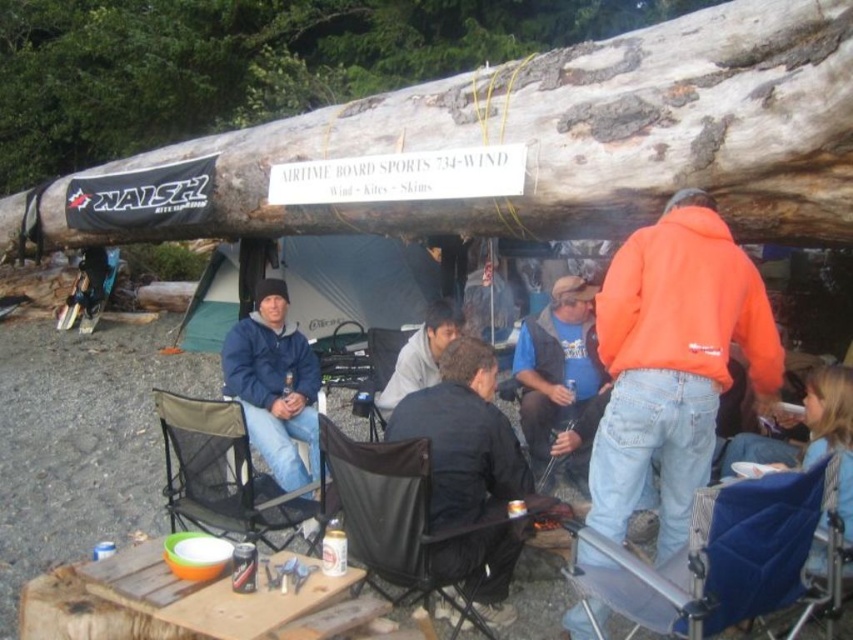
Question: Which object is closer to the camera taking this photo?

Choices:
 (A) wooden picnic table at lower left
 (B) light gray sweater at center

Answer: (A)

Question: Which object appears closest to the camera in this image?

Choices:
 (A) blue fabric chair at lower right
 (B) orange fleece jacket at center
 (C) natural wood log at upper center
 (D) blue fleece jacket at center

Answer: (A)

Question: Can you confirm if blue fabric chair at lower right is wider than black mesh chair at center?

Choices:
 (A) no
 (B) yes

Answer: (B)

Question: Where is black leather jacket at center located in relation to black fabric chair at center in the image?

Choices:
 (A) right
 (B) left

Answer: (A)

Question: Which object is farther from the camera taking this photo?

Choices:
 (A) natural wood log at upper center
 (B) black leather jacket at center

Answer: (A)

Question: Is blue fabric chair at lower right thinner than blue fleece jacket at center?

Choices:
 (A) no
 (B) yes

Answer: (A)